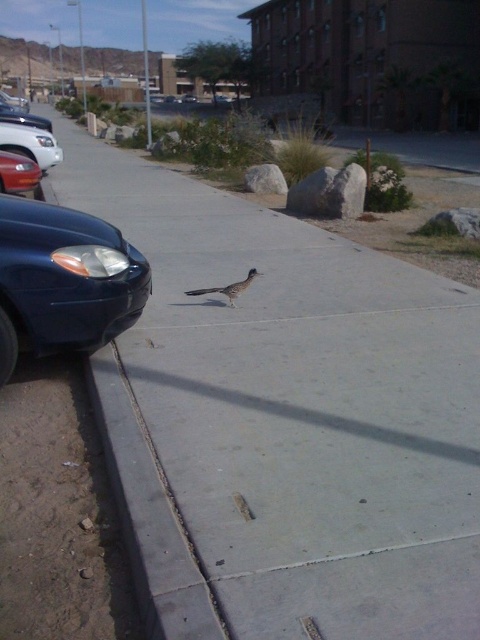
From the picture: Can you confirm if matte white suv at upper left is positioned below shiny silver sedan at left?

Yes.

Which is behind, point (20, 140) or point (3, 120)?

The point (3, 120) is behind.

The height and width of the screenshot is (640, 480). What are the coordinates of `matte white suv at upper left` in the screenshot? It's located at (31, 144).

Between point (106, 292) and point (40, 176), which one is positioned in front?

Point (106, 292) is more forward.

Can you confirm if glossy blue sedan at left is wider than matte black sedan at left?

Yes, glossy blue sedan at left is wider than matte black sedan at left.

Who is more distant from viewer, (40, 260) or (24, 195)?

The point (24, 195) is behind.

The height and width of the screenshot is (640, 480). I want to click on glossy blue sedan at left, so click(x=63, y=280).

Between point (26, 152) and point (22, 182), which one is positioned in front?

Point (22, 182) is more forward.

Is matte white suv at upper left positioned at the back of matte black sedan at left?

Yes, matte white suv at upper left is behind matte black sedan at left.

Is point (52, 154) closer to camera compared to point (25, 168)?

No, it is behind (25, 168).

Locate an element on the screen. This screenshot has height=640, width=480. matte white suv at upper left is located at coordinates 31,144.